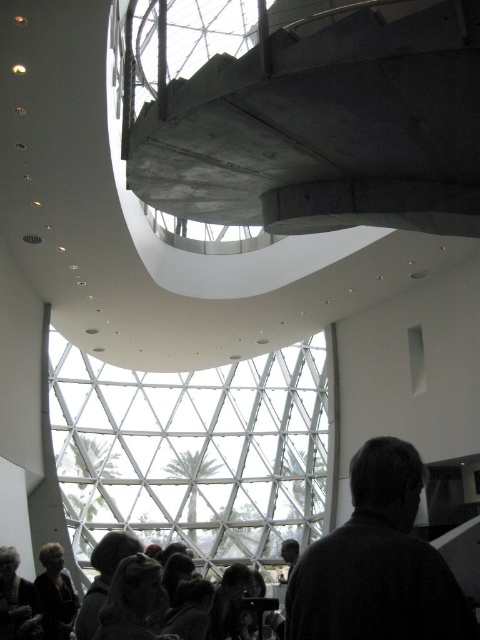
Question: Is concrete/stone staircase at upper center positioned behind dark brown hair at lower center?

Choices:
 (A) no
 (B) yes

Answer: (A)

Question: Does dark gray hair at lower left lie in front of dark gray sweater at lower left?

Choices:
 (A) yes
 (B) no

Answer: (A)

Question: Which of the following is the farthest from the observer?

Choices:
 (A) dark gray sweater at lower left
 (B) dark brown hair at lower center

Answer: (A)

Question: Among these points, which one is farthest from the camera?

Choices:
 (A) (54, 628)
 (B) (275, 608)
 (C) (383, 560)

Answer: (A)

Question: Can you confirm if dark brown hair at lower center is positioned to the left of dark gray hair at lower left?

Choices:
 (A) no
 (B) yes

Answer: (A)

Question: Which object appears farthest from the camera in this image?

Choices:
 (A) dark gray sweater at lower right
 (B) dark gray hair at lower left

Answer: (B)